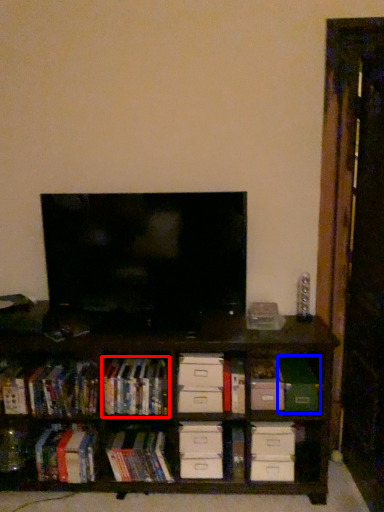
Question: Which of the following is the farthest to the observer, book (highlighted by a red box) or paperback book (highlighted by a blue box)?

Choices:
 (A) book
 (B) paperback book

Answer: (B)